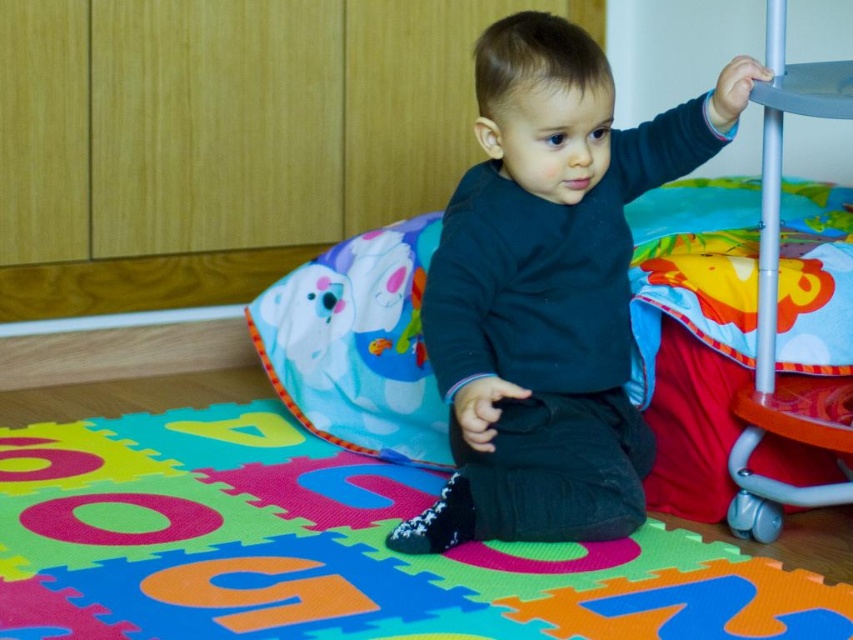
The child is sitting on a play mat and has two items in front of them. The multicolored foam puzzle at center and the matte black shirt at center. Which item is wider?

The multicolored foam puzzle at center is wider than the matte black shirt at center because the multicolored foam puzzle at center has a greater width.

You are a photographer taking a picture of the scene. You need to focus on both the point at point (142, 545) and the point at point (552, 129). Which point should you focus on first to ensure both are in focus?

You should focus on point (142, 545) first because it is closer to the viewer than point (552, 129). By focusing on the closer point, the depth of field may also cover the farther point.